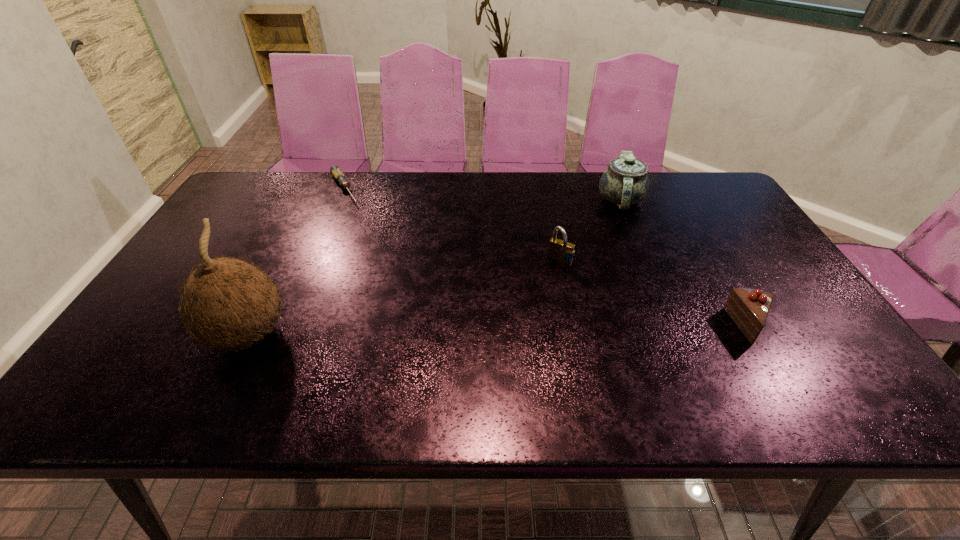
You are a GUI agent. You are given a task and a screenshot of the screen. Output one action in this format:
    pyautogui.click(x=<x>, y=<y>)
    Task: Click on the free space between the tallest object and the screwdriver
    The height and width of the screenshot is (540, 960).
    Given the screenshot: What is the action you would take?
    pyautogui.click(x=296, y=262)

Point out which object is positioned as the nearest to the chinaware. Please provide its 2D coordinates. Your answer should be formatted as a tuple, i.e. [(x, y)], where the tuple contains the x and y coordinates of a point satisfying the conditions above.

[(561, 251)]

The height and width of the screenshot is (540, 960). I want to click on the second closest object to the second shortest object, so click(561, 251).